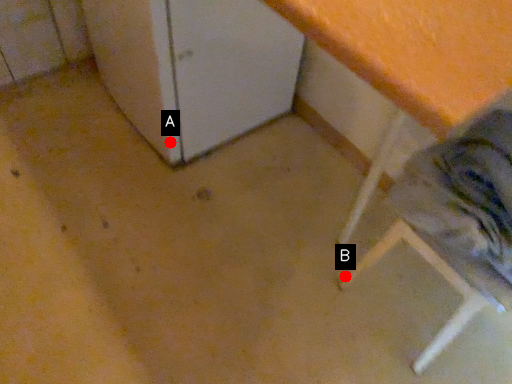
Question: Two points are circled on the image, labeled by A and B beside each circle. Among these points, which one is nearest to the camera?

Choices:
 (A) A is closer
 (B) B is closer

Answer: (B)